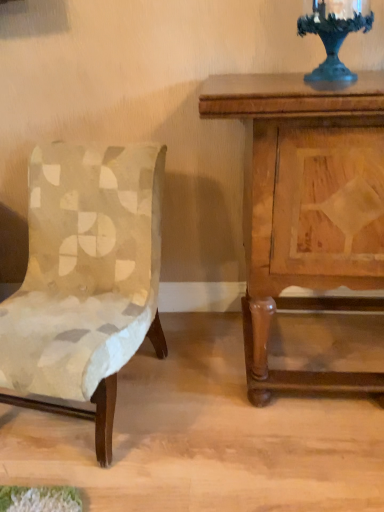
This screenshot has width=384, height=512. Find the location of `vacant space underneath velvet beige chair at left (from a real-world perspective)`. vacant space underneath velvet beige chair at left (from a real-world perspective) is located at coordinates (77, 413).